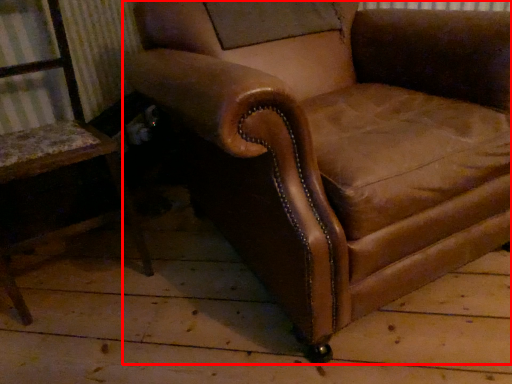
Question: From the image's perspective, where is chair (annotated by the red box) located relative to chair?

Choices:
 (A) above
 (B) below

Answer: (A)